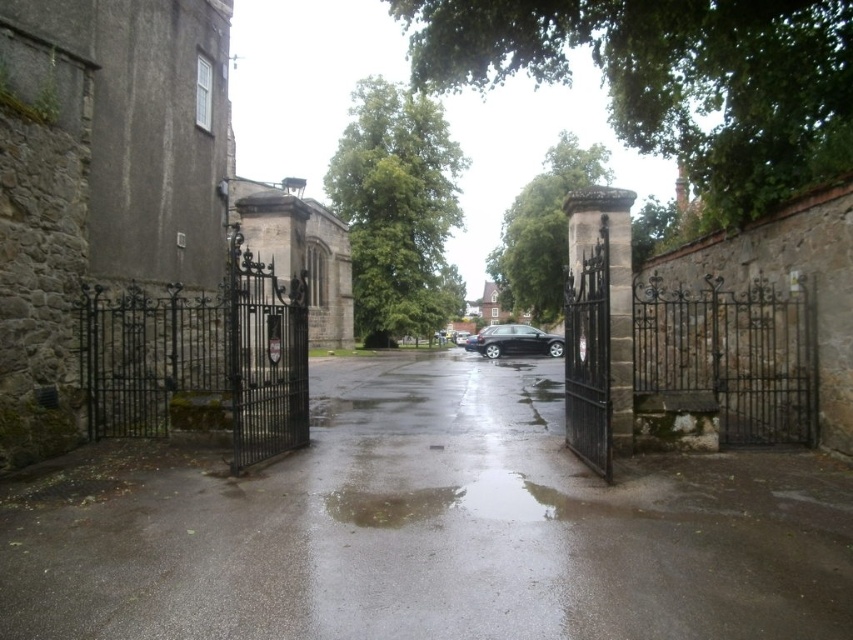
Between glossy asphalt alley at center and glossy black car at center, which one has more height?

glossy black car at center

Which is behind, point (183, 541) or point (469, 349)?

Positioned behind is point (469, 349).

Does point (160, 472) come closer to viewer compared to point (552, 342)?

Yes, point (160, 472) is closer to viewer.

The height and width of the screenshot is (640, 853). I want to click on glossy asphalt alley at center, so click(428, 529).